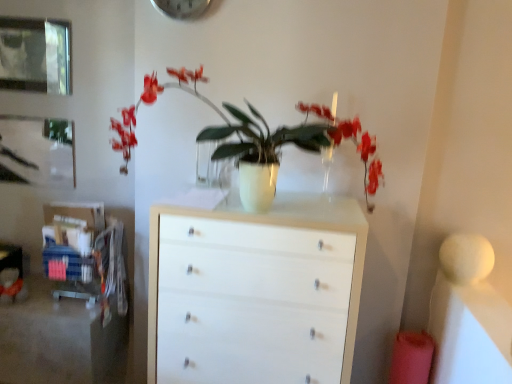
The image size is (512, 384). What do you see at coordinates (256, 139) in the screenshot?
I see `white glossy vase at center` at bounding box center [256, 139].

Describe the element at coordinates (35, 55) in the screenshot. I see `metallic glass picture frame at upper left, the first picture frame viewed from the front` at that location.

Locate an element on the screen. This screenshot has width=512, height=384. white glossy chest of drawers at center is located at coordinates (255, 291).

What is the approximate width of brushed metal picture frame at upper left, which appears as the 2th picture frame when viewed from the top?

brushed metal picture frame at upper left, which appears as the 2th picture frame when viewed from the top, is 2.04 centimeters wide.

Find the location of a particular element. brushed metal picture frame at upper left, which ranks as the 1th picture frame in bottom-to-top order is located at coordinates (37, 151).

The height and width of the screenshot is (384, 512). Identify the location of white glossy vase at center. (256, 139).

Is white glossy vase at center to the left of metallic glass picture frame at upper left, the first picture frame in the top-to-bottom sequence, from the viewer's perspective?

Incorrect, white glossy vase at center is not on the left side of metallic glass picture frame at upper left, the first picture frame in the top-to-bottom sequence.

Does white glossy vase at center touch metallic glass picture frame at upper left, the 2th picture frame from the bottom?

white glossy vase at center and metallic glass picture frame at upper left, the 2th picture frame from the bottom, are not in contact.

Is point (260, 178) closer or farther from the camera than point (7, 68)?

Point (260, 178) is closer to the camera than point (7, 68).

Is white glossy vase at center not within metallic glass picture frame at upper left, the 2th picture frame from the bottom?

Yes, white glossy vase at center is not within metallic glass picture frame at upper left, the 2th picture frame from the bottom.

Is brushed metal picture frame at upper left, which ranks as the 1th picture frame in bottom-to-top order, surrounding metallic silver clock at upper center?

No, metallic silver clock at upper center is not a part of brushed metal picture frame at upper left, which ranks as the 1th picture frame in bottom-to-top order.

Considering the relative sizes of brushed metal picture frame at upper left, which is the 2th picture frame from front to back, and metallic silver clock at upper center in the image provided, is brushed metal picture frame at upper left, which is the 2th picture frame from front to back, wider than metallic silver clock at upper center?

In fact, brushed metal picture frame at upper left, which is the 2th picture frame from front to back, might be narrower than metallic silver clock at upper center.

Between brushed metal picture frame at upper left, which ranks as the 1th picture frame in bottom-to-top order, and metallic silver clock at upper center, which one has less height?

Standing shorter between the two is metallic silver clock at upper center.

Can you confirm if brushed metal picture frame at upper left, which is the 2th picture frame from front to back, is bigger than metallic silver clock at upper center?

Actually, brushed metal picture frame at upper left, which is the 2th picture frame from front to back, might be smaller than metallic silver clock at upper center.

From the picture: Is metallic glass picture frame at upper left, the first picture frame in the top-to-bottom sequence, at the right side of white glossy vase at center?

Incorrect, metallic glass picture frame at upper left, the first picture frame in the top-to-bottom sequence, is not on the right side of white glossy vase at center.

In the image, is metallic glass picture frame at upper left, the first picture frame in the top-to-bottom sequence, positioned in front of or behind white glossy vase at center?

In the image, metallic glass picture frame at upper left, the first picture frame in the top-to-bottom sequence, appears behind white glossy vase at center.

Would you say metallic glass picture frame at upper left, the 2th picture frame from the bottom, contains white glossy vase at center?

No, white glossy vase at center is not a part of metallic glass picture frame at upper left, the 2th picture frame from the bottom.

There is a white glossy vase at center. Where is `picture frame above it (from a real-world perspective)`? picture frame above it (from a real-world perspective) is located at coordinates (35, 55).

Is metallic silver clock at upper center positioned before white glossy vase at center?

No, metallic silver clock at upper center is further to the viewer.

Is point (185, 13) closer to viewer compared to point (234, 110)?

No, (185, 13) is behind (234, 110).

Looking at this image, is metallic silver clock at upper center positioned far away from white glossy vase at center?

No, there isn't a large distance between metallic silver clock at upper center and white glossy vase at center.

Considering the positions of objects metallic glass picture frame at upper left, the 2th picture frame from the bottom, and metallic silver clock at upper center in the image provided, who is in front, metallic glass picture frame at upper left, the 2th picture frame from the bottom, or metallic silver clock at upper center?

metallic silver clock at upper center.

Which of these two, metallic glass picture frame at upper left, the first picture frame in the top-to-bottom sequence, or metallic silver clock at upper center, is wider?

With larger width is metallic silver clock at upper center.

Between point (5, 61) and point (181, 10), which one is positioned behind?

The point (5, 61) is behind.

Considering the relative sizes of white glossy chest of drawers at center and brushed metal picture frame at upper left, which appears as the 2th picture frame when viewed from the top, in the image provided, is white glossy chest of drawers at center bigger than brushed metal picture frame at upper left, which appears as the 2th picture frame when viewed from the top,?

Correct, white glossy chest of drawers at center is larger in size than brushed metal picture frame at upper left, which appears as the 2th picture frame when viewed from the top.

From a real-world perspective, is white glossy chest of drawers at center located higher than brushed metal picture frame at upper left, which ranks as the 1th picture frame in bottom-to-top order?

No.

Is white glossy chest of drawers at center aimed at brushed metal picture frame at upper left, which appears as the 2th picture frame when viewed from the top?

No, white glossy chest of drawers at center is not oriented towards brushed metal picture frame at upper left, which appears as the 2th picture frame when viewed from the top.

From the image's perspective, which picture frame is the 1st one above the white glossy chest of drawers at center? Please provide its 2D coordinates.

[(37, 151)]

Between brushed metal picture frame at upper left, which ranks as the 1th picture frame in bottom-to-top order, and metallic glass picture frame at upper left, the first picture frame in the top-to-bottom sequence, which one has more height?

Standing taller between the two is metallic glass picture frame at upper left, the first picture frame in the top-to-bottom sequence.

What's the angular difference between brushed metal picture frame at upper left, which appears as the 2th picture frame when viewed from the top, and metallic glass picture frame at upper left, the first picture frame viewed from the front,'s facing directions?

They differ by 0.00266 degrees in their facing directions.

Relative to metallic glass picture frame at upper left, the first picture frame in the top-to-bottom sequence, is brushed metal picture frame at upper left, which is the 2th picture frame from front to back, in front or behind?

brushed metal picture frame at upper left, which is the 2th picture frame from front to back, is behind metallic glass picture frame at upper left, the first picture frame in the top-to-bottom sequence.

Does point (65, 149) appear closer or farther from the camera than point (65, 34)?

Point (65, 149) is positioned farther from the camera compared to point (65, 34).

In order to click on houseplant below the metallic glass picture frame at upper left, acting as the second picture frame starting from the back (from a real-world perspective) in this screenshot , I will do `click(256, 139)`.

Starting from the metallic silver clock at upper center, which picture frame is the 2nd one behind? Please provide its 2D coordinates.

[(37, 151)]

Estimate the real-world distances between objects in this image. Which object is further from metallic silver clock at upper center, brushed metal picture frame at upper left, which appears as the 2th picture frame when viewed from the top, or white glossy chest of drawers at center?

white glossy chest of drawers at center is positioned further to the anchor metallic silver clock at upper center.

Which object lies nearer to the anchor point metallic silver clock at upper center, brushed metal picture frame at upper left, which ranks as the 1th picture frame in bottom-to-top order, or metallic glass picture frame at upper left, acting as the second picture frame starting from the back?

metallic glass picture frame at upper left, acting as the second picture frame starting from the back.

From the image, which object appears to be nearer to metallic silver clock at upper center, white glossy chest of drawers at center or brushed metal picture frame at upper left, which is the 2th picture frame from front to back?

Based on the image, brushed metal picture frame at upper left, which is the 2th picture frame from front to back, appears to be nearer to metallic silver clock at upper center.

Looking at the image, which one is located further to brushed metal picture frame at upper left, which appears as the 2th picture frame when viewed from the top, white glossy vase at center or white glossy chest of drawers at center?

The object further to brushed metal picture frame at upper left, which appears as the 2th picture frame when viewed from the top, is white glossy chest of drawers at center.

Considering their positions, is metallic glass picture frame at upper left, the first picture frame in the top-to-bottom sequence, positioned closer to white glossy vase at center than brushed metal picture frame at upper left, which is the 2th picture frame from front to back?

Among the two, brushed metal picture frame at upper left, which is the 2th picture frame from front to back, is located nearer to white glossy vase at center.

From the image, which object appears to be nearer to white glossy vase at center, brushed metal picture frame at upper left, which ranks as the 1th picture frame in bottom-to-top order, or metallic glass picture frame at upper left, acting as the second picture frame starting from the back?

brushed metal picture frame at upper left, which ranks as the 1th picture frame in bottom-to-top order, lies closer to white glossy vase at center than the other object.

From the image, which object appears to be nearer to brushed metal picture frame at upper left, which appears as the 2th picture frame when viewed from the top, metallic glass picture frame at upper left, the first picture frame viewed from the front, or metallic silver clock at upper center?

metallic glass picture frame at upper left, the first picture frame viewed from the front.

In the scene shown: When comparing their distances from white glossy vase at center, does white glossy chest of drawers at center or brushed metal picture frame at upper left, which ranks as the first picture frame in back-to-front order, seem closer?

The object closer to white glossy vase at center is white glossy chest of drawers at center.

The image size is (512, 384). In order to click on houseplant between metallic silver clock at upper center and white glossy chest of drawers at center in the vertical direction in this screenshot , I will do [x=256, y=139].

I want to click on houseplant between brushed metal picture frame at upper left, which ranks as the 1th picture frame in bottom-to-top order, and white glossy chest of drawers at center from left to right, so click(256, 139).

Find the location of a particular element. This screenshot has width=512, height=384. clock between metallic glass picture frame at upper left, acting as the second picture frame starting from the back, and white glossy vase at center from left to right is located at coordinates (182, 8).

At what (x,y) coordinates should I click in order to perform the action: click on picture frame between brushed metal picture frame at upper left, which ranks as the first picture frame in back-to-front order, and white glossy chest of drawers at center from left to right. Please return your answer as a coordinate pair (x, y). Looking at the image, I should click on (35, 55).